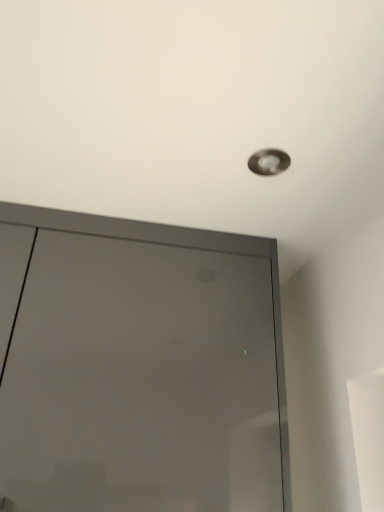
Question: Is matte silver droplight at upper center completely or partially inside matte gray door at upper center?

Choices:
 (A) no
 (B) yes

Answer: (A)

Question: Would you say matte gray door at upper center is a long distance from matte silver droplight at upper center?

Choices:
 (A) no
 (B) yes

Answer: (A)

Question: Is matte gray door at upper center oriented towards matte silver droplight at upper center?

Choices:
 (A) yes
 (B) no

Answer: (A)

Question: Is matte gray door at upper center positioned in front of matte silver droplight at upper center?

Choices:
 (A) yes
 (B) no

Answer: (A)

Question: Does matte gray door at upper center have a larger size compared to matte silver droplight at upper center?

Choices:
 (A) no
 (B) yes

Answer: (B)

Question: Is matte gray door at upper center looking in the opposite direction of matte silver droplight at upper center?

Choices:
 (A) yes
 (B) no

Answer: (B)

Question: From the image's perspective, is matte silver droplight at upper center under matte gray door at upper center?

Choices:
 (A) no
 (B) yes

Answer: (A)

Question: Is the surface of matte silver droplight at upper center in direct contact with matte gray door at upper center?

Choices:
 (A) yes
 (B) no

Answer: (B)

Question: Is matte silver droplight at upper center looking in the opposite direction of matte gray door at upper center?

Choices:
 (A) yes
 (B) no

Answer: (B)

Question: Is matte silver droplight at upper center thinner than matte gray door at upper center?

Choices:
 (A) no
 (B) yes

Answer: (B)

Question: Is matte gray door at upper center inside matte silver droplight at upper center?

Choices:
 (A) yes
 (B) no

Answer: (B)

Question: Is matte silver droplight at upper center at the right side of matte gray door at upper center?

Choices:
 (A) yes
 (B) no

Answer: (A)

Question: Is matte silver droplight at upper center inside the boundaries of matte gray door at upper center, or outside?

Choices:
 (A) outside
 (B) inside

Answer: (A)